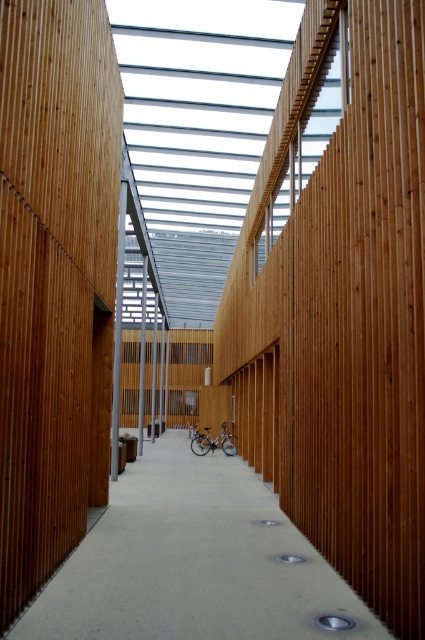
Is natural wood pillar at center closer to camera compared to silver metallic bicycle at center?

Yes, natural wood pillar at center is in front of silver metallic bicycle at center.

From the picture: Is natural wood pillar at center below silver metallic bicycle at center?

No.

Is point (40, 269) positioned behind point (226, 435)?

That is False.

You are a GUI agent. You are given a task and a screenshot of the screen. Output one action in this format:
    pyautogui.click(x=<x>, y=<y>)
    Task: Click on the natural wood pillar at center
    The width and height of the screenshot is (425, 640).
    Given the screenshot: What is the action you would take?
    pyautogui.click(x=53, y=280)

Looking at this image, can you confirm if concrete at center is bigger than silver metallic bicycle at center?

Yes, concrete at center is bigger than silver metallic bicycle at center.

Measure the distance between concrete at center and camera.

concrete at center and camera are 3.63 meters apart.

Which is behind, point (246, 586) or point (237, 444)?

The point (237, 444) is behind.

I want to click on concrete at center, so click(193, 563).

Does natural wood pillar at center come behind concrete at center?

That is False.

Is point (104, 387) positioned in front of point (255, 595)?

No, it is behind (255, 595).

Which is behind, point (36, 380) or point (195, 484)?

Positioned behind is point (195, 484).

Locate an element on the screen. This screenshot has height=640, width=425. natural wood pillar at center is located at coordinates (53, 280).